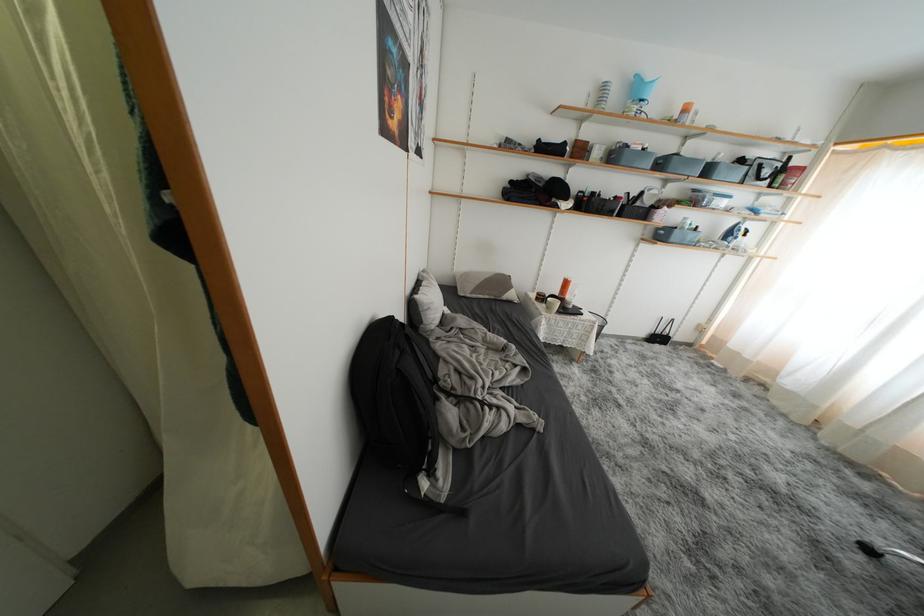
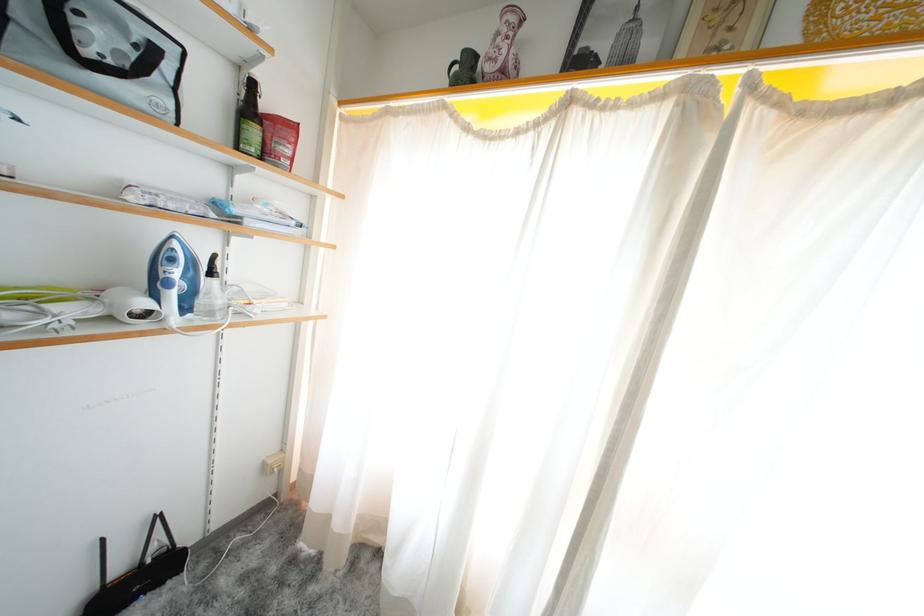
The point at (788, 188) is marked in the first image. Where is the corresponding point in the second image?

(273, 158)